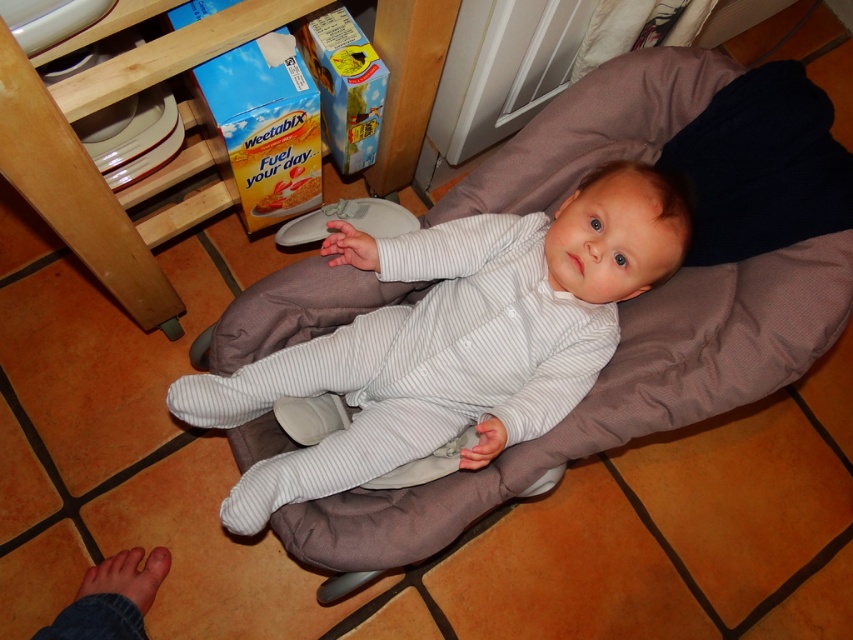
Who is more forward, (809, 296) or (407, 406)?

Positioned in front is point (809, 296).

Can you confirm if gray fabric baby seat at center is bigger than gray striped onesie at center?

Indeed, gray fabric baby seat at center has a larger size compared to gray striped onesie at center.

Find the location of a particular element. Image resolution: width=853 pixels, height=640 pixels. gray fabric baby seat at center is located at coordinates (616, 396).